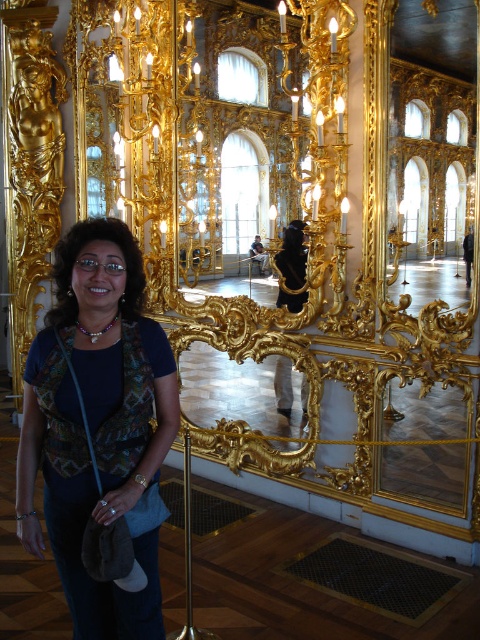
You are an interior designer assessing the placement of objects in this luxurious space. The woman is standing in front of a large mirror. Where is the matte blue shirt at center positioned relative to the woman?

The matte blue shirt at center is located at point coordinates of 0.667 on the x and 0.204 on the y axis, which places it slightly to the right and above the woman who is positioned slightly left of center.

You are standing in the luxurious interior and want to determine which of the two points, point (104, 520) or point (228, 413), is nearer to you. Which one is closer?

Point (104, 520) is closer to the viewer than point (228, 413).

You are a photographer setting up a shoot in this luxurious interior. You notice the matte blue shirt at center and the gold ornate mirror at center. Which object is closer to the camera?

The matte blue shirt at center is positioned over the gold ornate mirror at center, so it is closer to the camera.